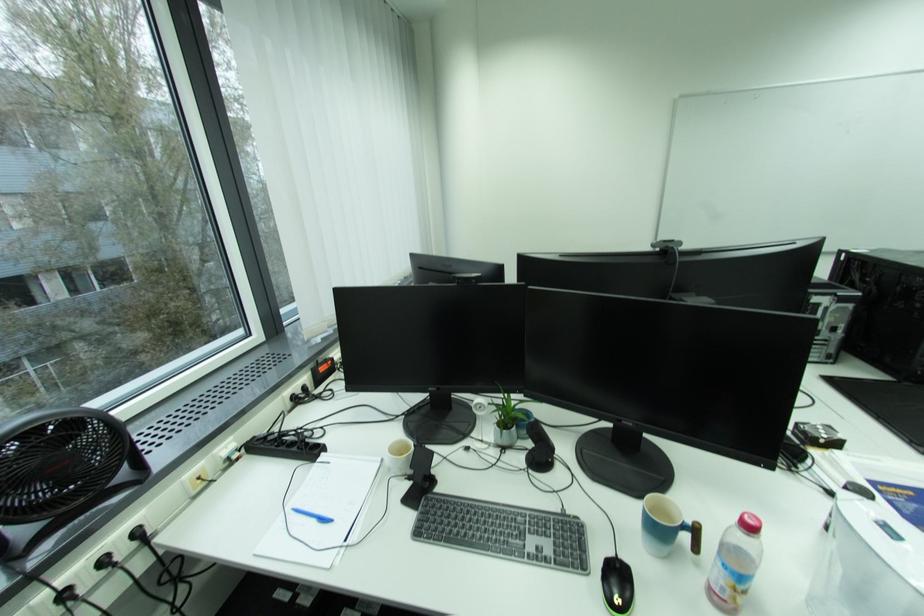
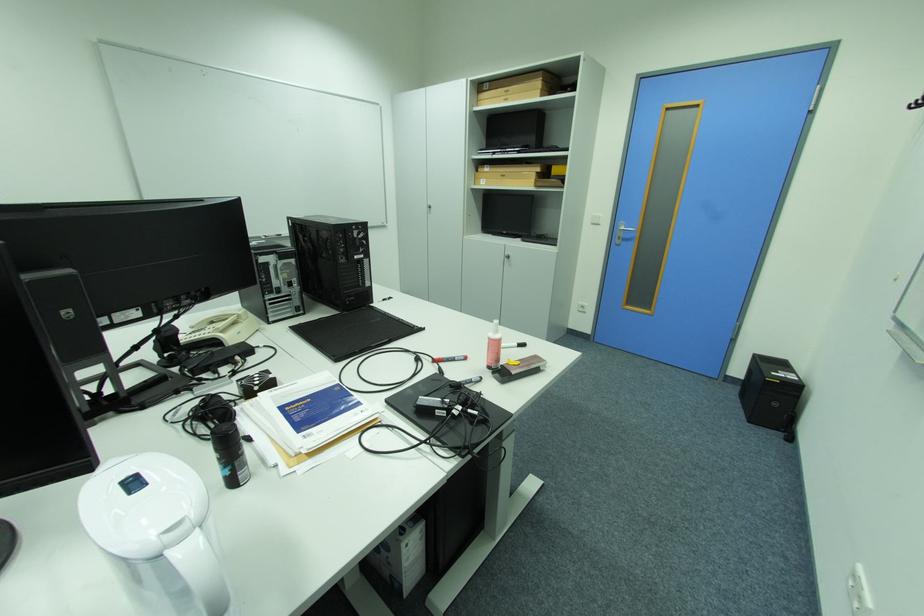
Question: How did the camera likely rotate?

Choices:
 (A) Left
 (B) Right
 (C) Up
 (D) Down

Answer: (B)